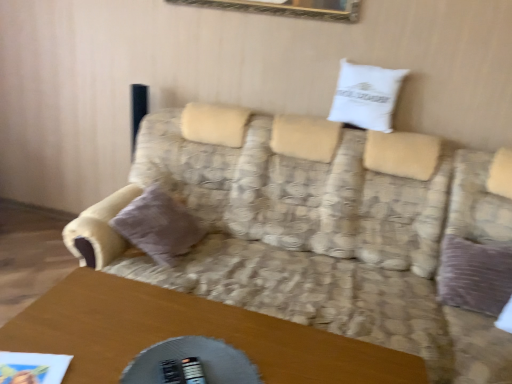
Question: Is velvet purple pillow at left, which is counted as the 2th pillow, starting from the right, oriented towards white cotton pillow at upper center, which appears as the first pillow when viewed from the top?

Choices:
 (A) yes
 (B) no

Answer: (B)

Question: Is velvet purple pillow at left, positioned as the 1th pillow in left-to-right order, far from white cotton pillow at upper center, marked as the 2th pillow in a left-to-right arrangement?

Choices:
 (A) yes
 (B) no

Answer: (A)

Question: Is velvet purple pillow at left, marked as the first pillow in a bottom-to-top arrangement, outside white cotton pillow at upper center, which is the 2th pillow in bottom-to-top order?

Choices:
 (A) no
 (B) yes

Answer: (B)

Question: Can you confirm if velvet purple pillow at left, marked as the first pillow in a bottom-to-top arrangement, is bigger than white cotton pillow at upper center, marked as the 2th pillow in a left-to-right arrangement?

Choices:
 (A) yes
 (B) no

Answer: (A)

Question: Does velvet purple pillow at left, marked as the first pillow in a bottom-to-top arrangement, have a lesser height compared to white cotton pillow at upper center, the first pillow when ordered from right to left?

Choices:
 (A) yes
 (B) no

Answer: (B)

Question: Is white cotton pillow at upper center, marked as the 2th pillow in a left-to-right arrangement, at the back of velvet purple pillow at left, which is counted as the 2th pillow, starting from the right?

Choices:
 (A) no
 (B) yes

Answer: (A)

Question: Does velvet purple pillow at left, which is counted as the 2th pillow, starting from the top, lie behind wooden table at lower center?

Choices:
 (A) yes
 (B) no

Answer: (A)

Question: Considering the relative sizes of velvet purple pillow at left, marked as the first pillow in a bottom-to-top arrangement, and wooden table at lower center in the image provided, is velvet purple pillow at left, marked as the first pillow in a bottom-to-top arrangement, shorter than wooden table at lower center?

Choices:
 (A) no
 (B) yes

Answer: (B)

Question: Would you say wooden table at lower center is part of velvet purple pillow at left, marked as the first pillow in a bottom-to-top arrangement,'s contents?

Choices:
 (A) yes
 (B) no

Answer: (B)

Question: From the image's perspective, is velvet purple pillow at left, positioned as the 1th pillow in left-to-right order, under wooden table at lower center?

Choices:
 (A) no
 (B) yes

Answer: (A)

Question: Does velvet purple pillow at left, which is counted as the 2th pillow, starting from the right, have a larger size compared to wooden table at lower center?

Choices:
 (A) yes
 (B) no

Answer: (B)

Question: Is velvet purple pillow at left, positioned as the 1th pillow in left-to-right order, at the right side of wooden table at lower center?

Choices:
 (A) yes
 (B) no

Answer: (B)

Question: Is wooden table at lower center positioned before white cotton pillow at upper center, which is the 2th pillow in bottom-to-top order?

Choices:
 (A) no
 (B) yes

Answer: (B)